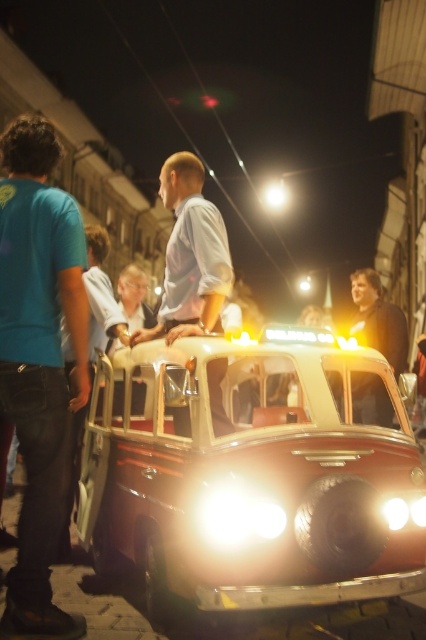
You are a photographer trying to capture a clear shot of the shiny red car at center and the matte white shirt at center. Which object should you focus on first if you want to ensure both are in focus without adjusting the camera settings?

The shiny red car at center is positioned under matte white shirt at center, so focusing on the matte white shirt at center first would ensure both are in focus since it is closer to the camera.

You are a photographer trying to capture the entire scene in one shot. Given that the matte white shirt at center and the glossy plastic headlight at lower center are both in focus, which object will appear larger in the photo?

The matte white shirt at center will appear larger in the photo because it is bigger than the glossy plastic headlight at lower center.